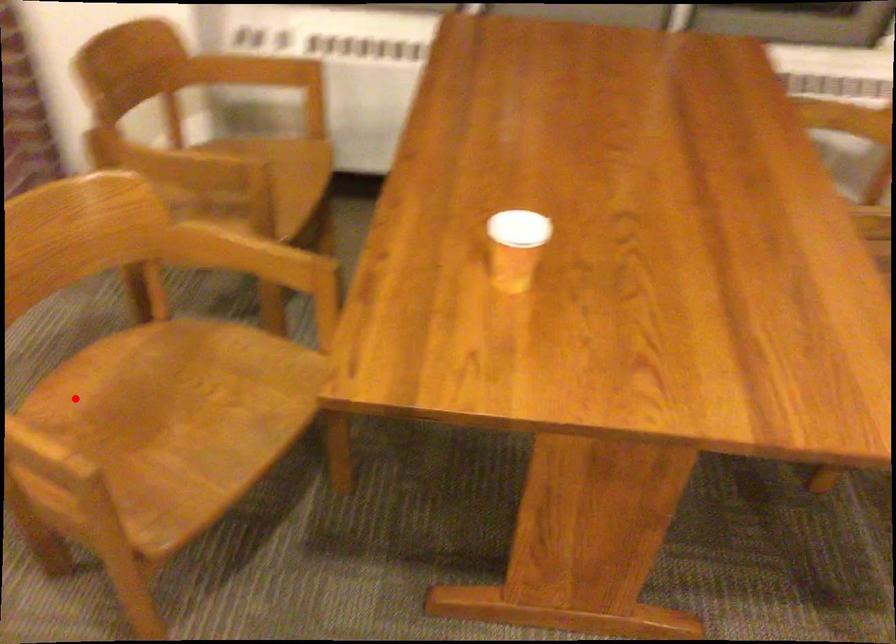
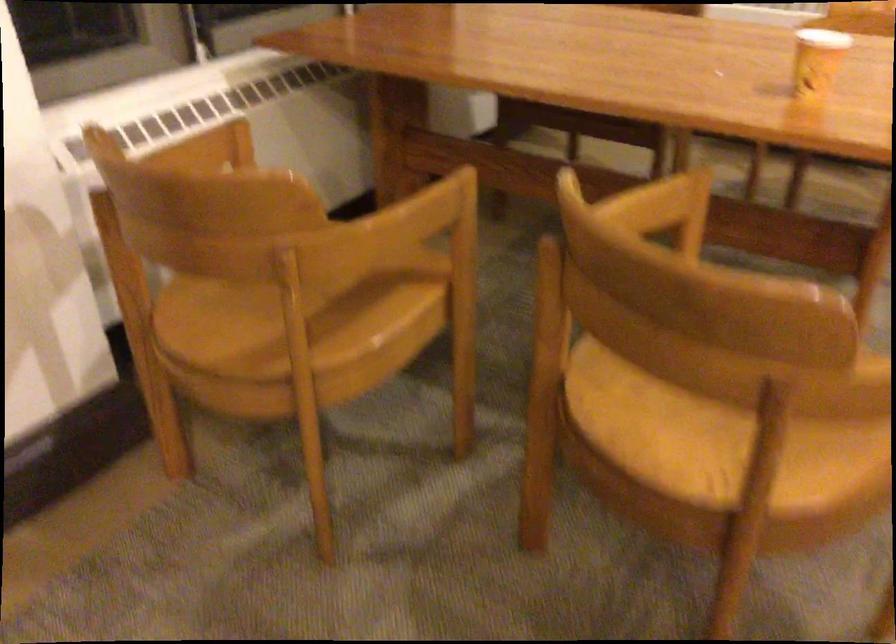
Question: I am providing you with two images of the same scene from different viewpoints. A red point is shown in image1. For the corresponding object point in image2, is it positioned nearer or farther from the camera?

Choices:
 (A) Nearer
 (B) Farther

Answer: (A)